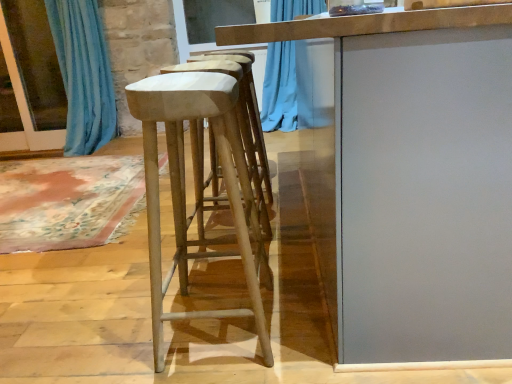
Question: From a real-world perspective, is smooth gray table at center positioned above or below blue fabric curtain at left?

Choices:
 (A) below
 (B) above

Answer: (A)

Question: In terms of width, does smooth gray table at center look wider or thinner when compared to blue fabric curtain at left?

Choices:
 (A) thin
 (B) wide

Answer: (B)

Question: Estimate the real-world distances between objects in this image. Which object is farther from the smooth gray table at center?

Choices:
 (A) light brown wood stool at center
 (B) blue fabric curtain at left

Answer: (B)

Question: Estimate the real-world distances between objects in this image. Which object is farther from the light brown wood stool at center?

Choices:
 (A) blue fabric curtain at left
 (B) smooth gray table at center

Answer: (A)